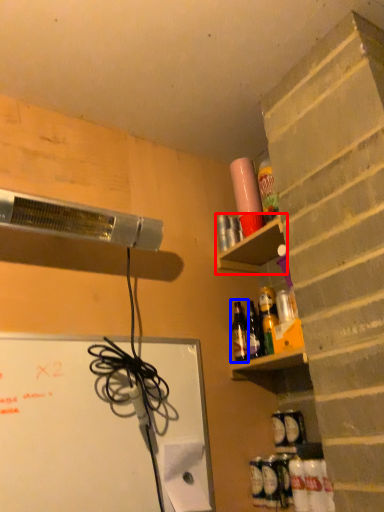
Question: Among these objects, which one is farthest to the camera, shelf (highlighted by a red box) or bottle (highlighted by a blue box)?

Choices:
 (A) shelf
 (B) bottle

Answer: (B)